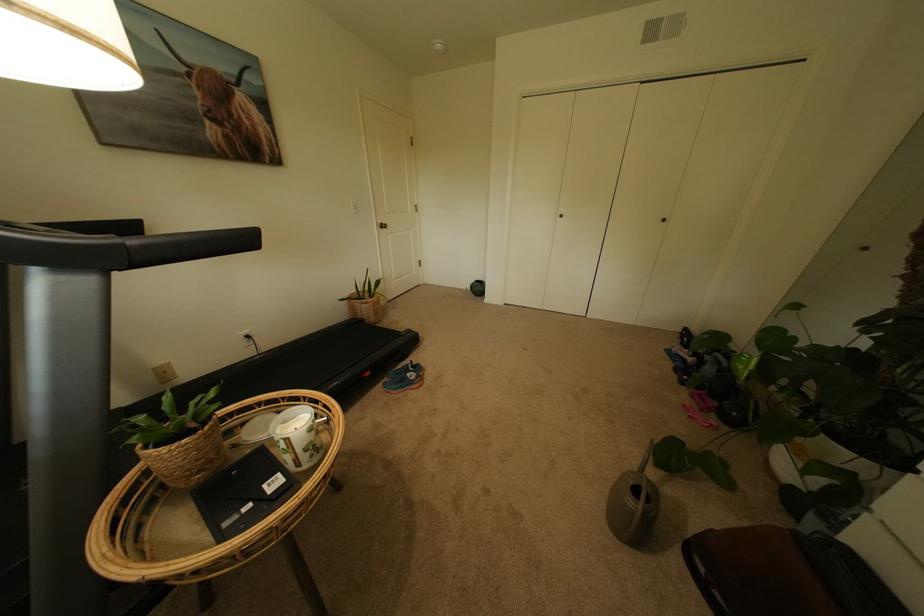
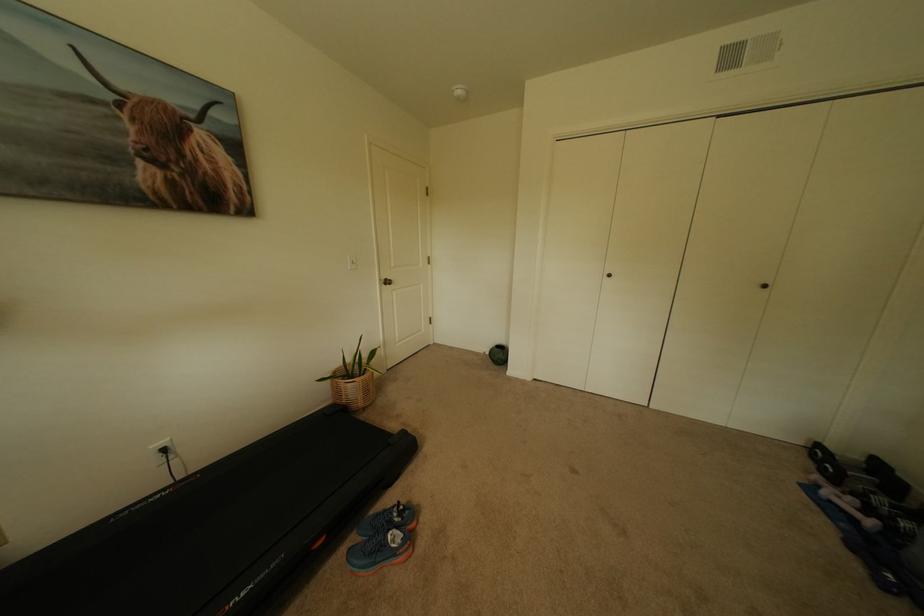
Locate, in the second image, the point that corresponds to point (473, 289) in the first image.

(491, 353)